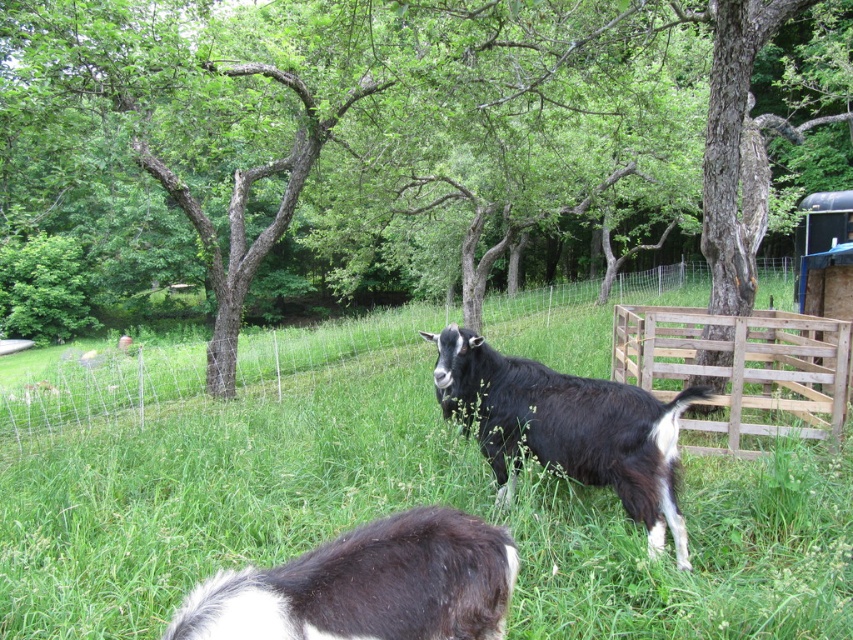
Question: Which point is closer to the camera taking this photo?

Choices:
 (A) (764, 321)
 (B) (676, 410)
 (C) (390, 554)
 (D) (55, 339)

Answer: (C)

Question: Observing the image, what is the correct spatial positioning of black woolen goat at center in reference to wooden gate at right?

Choices:
 (A) left
 (B) right

Answer: (A)

Question: Estimate the real-world distances between objects in this image. Which object is closer to the wooden gate at right?

Choices:
 (A) black fuzzy goat at lower center
 (B) black woolen goat at center
 (C) wooden fence at center

Answer: (B)

Question: Which object appears closest to the camera in this image?

Choices:
 (A) black fuzzy goat at lower center
 (B) wooden gate at right
 (C) wooden fence at center

Answer: (A)

Question: From the image, what is the correct spatial relationship of green grassy at center in relation to black woolen goat at center?

Choices:
 (A) below
 (B) above

Answer: (B)

Question: Can you confirm if wooden fence at center is wider than black woolen goat at center?

Choices:
 (A) no
 (B) yes

Answer: (B)